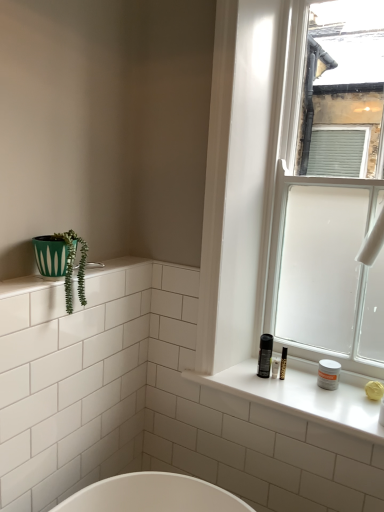
Question: Is matte black spray can at right, positioned as the 2th toiletry in right-to-left order, facing towards white glass window at right?

Choices:
 (A) no
 (B) yes

Answer: (A)

Question: Does matte black spray can at right, positioned as the 2th toiletry in right-to-left order, appear on the left side of white glass window at right?

Choices:
 (A) yes
 (B) no

Answer: (A)

Question: Is matte black spray can at right, positioned as the 2th toiletry in right-to-left order, thinner than white glass window at right?

Choices:
 (A) yes
 (B) no

Answer: (A)

Question: From a real-world perspective, is matte black spray can at right, arranged as the first toiletry when viewed from the left, positioned under white glass window at right based on gravity?

Choices:
 (A) yes
 (B) no

Answer: (A)

Question: Considering the relative sizes of matte black spray can at right, arranged as the first toiletry when viewed from the left, and white glass window at right in the image provided, is matte black spray can at right, arranged as the first toiletry when viewed from the left, taller than white glass window at right?

Choices:
 (A) yes
 (B) no

Answer: (B)

Question: Is matte black spray can at right, positioned as the 2th toiletry in right-to-left order, bigger than white glass window at right?

Choices:
 (A) no
 (B) yes

Answer: (A)

Question: Is white matte jar at window, which is counted as the 2th toiletry, starting from the left, bigger than matte black spray can at right, arranged as the first toiletry when viewed from the left?

Choices:
 (A) no
 (B) yes

Answer: (A)

Question: Does white matte jar at window, which is counted as the 2th toiletry, starting from the left, have a greater width compared to matte black spray can at right, arranged as the first toiletry when viewed from the left?

Choices:
 (A) yes
 (B) no

Answer: (B)

Question: Does white matte jar at window, which is counted as the 2th toiletry, starting from the left, lie in front of matte black spray can at right, arranged as the first toiletry when viewed from the left?

Choices:
 (A) yes
 (B) no

Answer: (A)

Question: From the image's perspective, is white matte jar at window, which is the 1th toiletry in right-to-left order, beneath matte black spray can at right, arranged as the first toiletry when viewed from the left?

Choices:
 (A) yes
 (B) no

Answer: (A)

Question: Is white matte jar at window, which is the 1th toiletry in right-to-left order, turned away from matte black spray can at right, positioned as the 2th toiletry in right-to-left order?

Choices:
 (A) yes
 (B) no

Answer: (B)

Question: Is white matte jar at window, which is counted as the 2th toiletry, starting from the left, at the right side of matte black spray can at right, arranged as the first toiletry when viewed from the left?

Choices:
 (A) yes
 (B) no

Answer: (A)

Question: Is white glossy window sill at right oriented away from white matte jar at window, which is counted as the 2th toiletry, starting from the left?

Choices:
 (A) yes
 (B) no

Answer: (B)